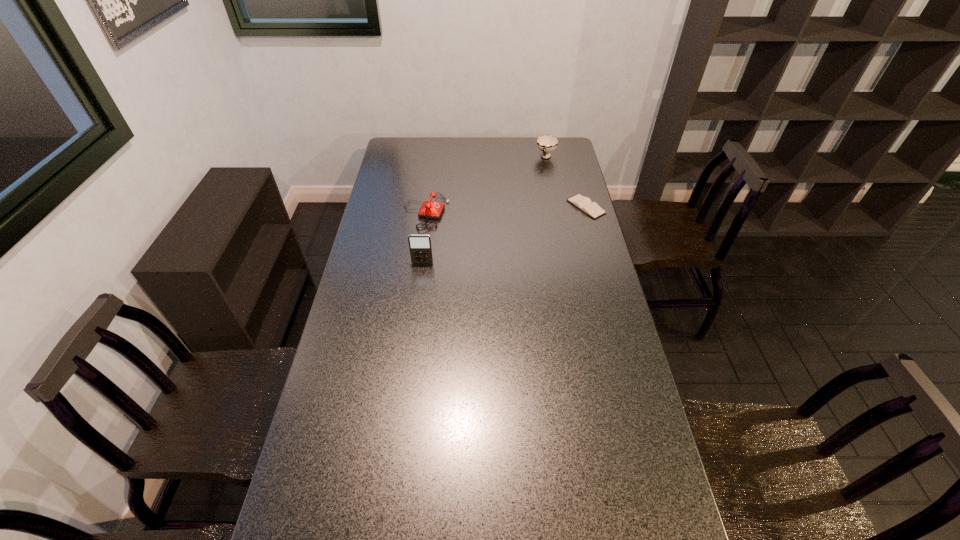
I want to click on vacant region located on the dial of the telephone, so click(499, 222).

Locate an element on the screen. vacant space located 0.060m on the side of the third shortest object with the handle is located at coordinates (541, 171).

The width and height of the screenshot is (960, 540). In order to click on free location located on the side of the third shortest object with the handle in this screenshot , I will do click(540, 178).

You are a GUI agent. You are given a task and a screenshot of the screen. Output one action in this format:
    pyautogui.click(x=<x>, y=<y>)
    Task: Click on the free spot located on the side of the third shortest object with the handle
    This screenshot has height=540, width=960.
    Given the screenshot: What is the action you would take?
    pyautogui.click(x=530, y=202)

This screenshot has width=960, height=540. What are the coordinates of `object that is at the far edge` in the screenshot? It's located at (547, 143).

Identify the location of object that is positioned at the left edge. (430, 209).

This screenshot has height=540, width=960. What are the coordinates of `diary present at the right edge` in the screenshot? It's located at (583, 203).

What are the coordinates of `cup located in the right edge section of the desktop` in the screenshot? It's located at click(x=547, y=143).

I want to click on object that is positioned at the far right corner, so click(547, 143).

Locate an element on the screen. This screenshot has width=960, height=540. vacant space at the far edge of the desktop is located at coordinates (485, 140).